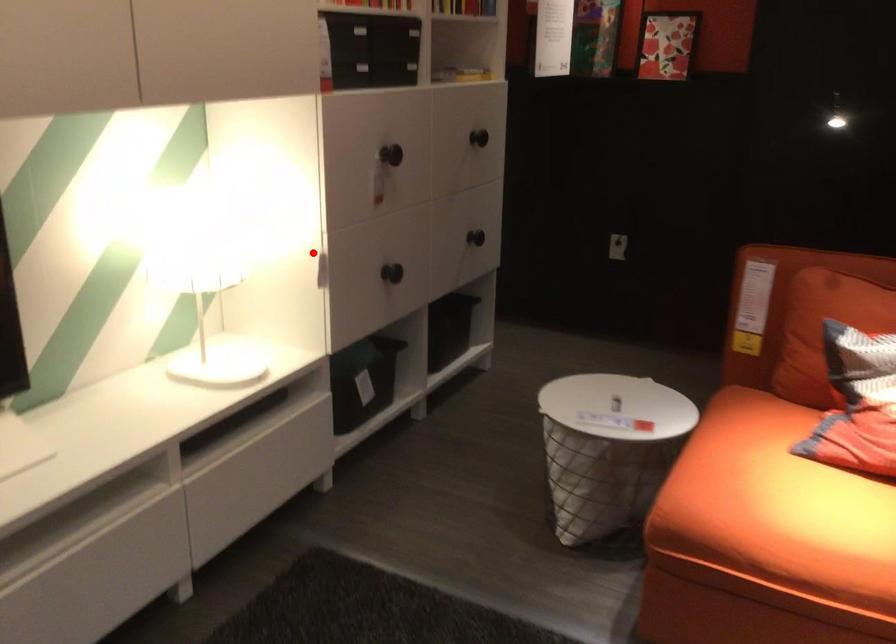
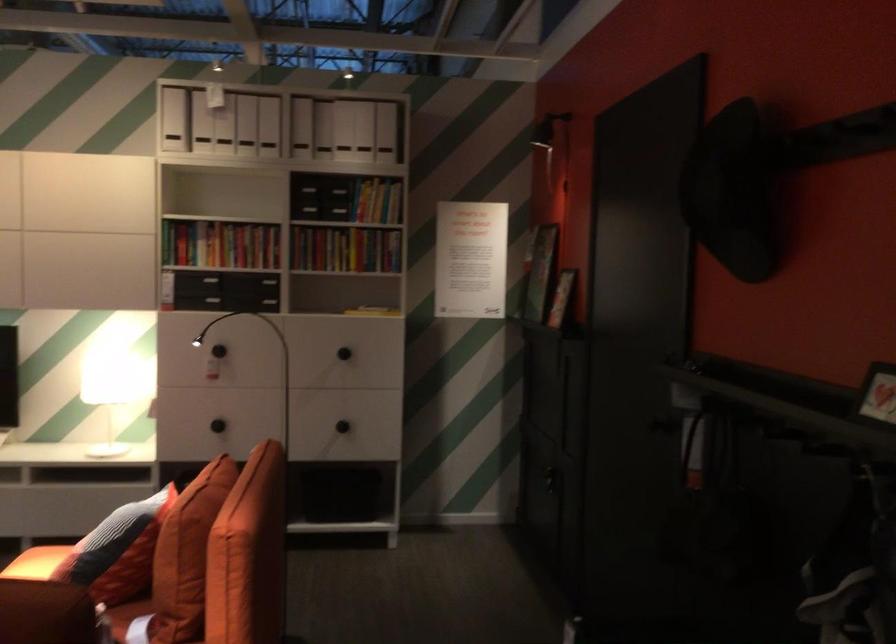
In the second image, find the point that corresponds to the highlighted location in the first image.

(108, 391)